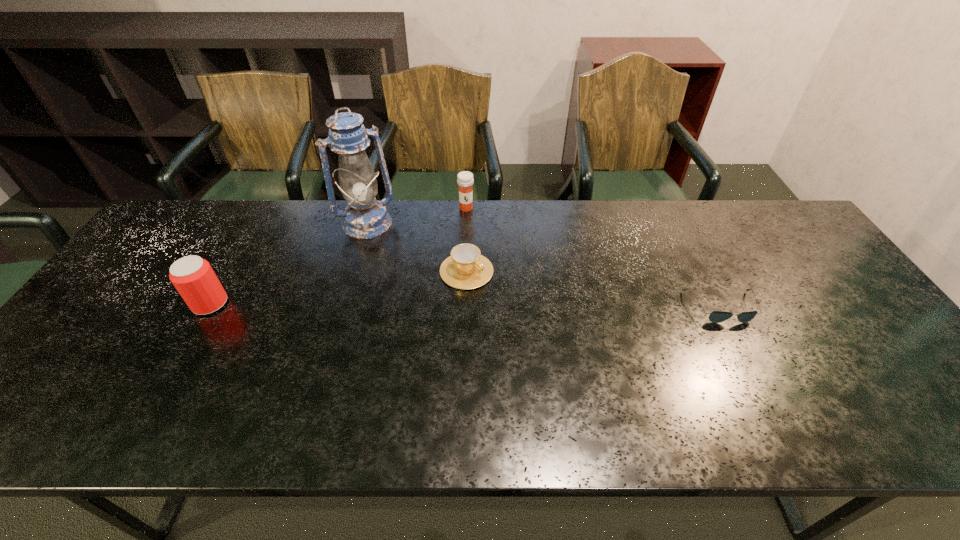
This screenshot has height=540, width=960. I want to click on the leftmost object, so click(193, 277).

I want to click on the shortest object, so 716,316.

This screenshot has height=540, width=960. Find the location of `the rightmost object`. the rightmost object is located at coordinates (716, 316).

At what (x,y) coordinates should I click in order to perform the action: click on the tallest object. Please return your answer as a coordinate pair (x, y). The image size is (960, 540). Looking at the image, I should click on (365, 217).

Where is `lantern`? The image size is (960, 540). lantern is located at coordinates (365, 217).

Where is `cup`? cup is located at coordinates (466, 268).

You are a GUI agent. You are given a task and a screenshot of the screen. Output one action in this format:
    pyautogui.click(x=<x>, y=<y>)
    Task: Click on the second shortest object
    This screenshot has height=540, width=960.
    Given the screenshot: What is the action you would take?
    pyautogui.click(x=466, y=268)

Locate an element on the screen. Image resolution: width=960 pixels, height=540 pixels. medicine is located at coordinates (465, 180).

Where is `free region located 0.140m on the front of the beer can`? The width and height of the screenshot is (960, 540). free region located 0.140m on the front of the beer can is located at coordinates (177, 362).

I want to click on free location located on the lenses of the shortest object, so click(x=742, y=347).